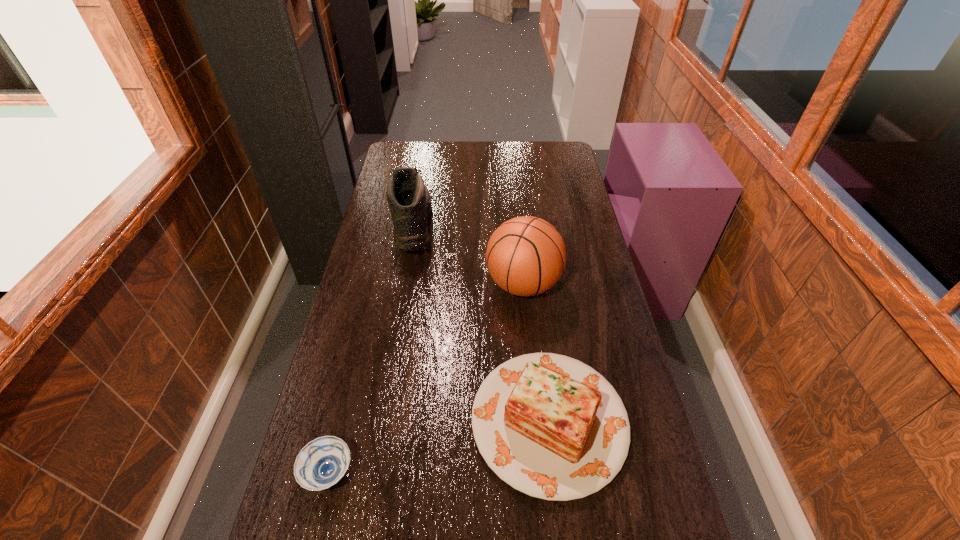
I want to click on ski boot, so click(x=409, y=200).

Where is `basketball`? The image size is (960, 540). basketball is located at coordinates (526, 256).

This screenshot has height=540, width=960. Find the location of `lasagna`. lasagna is located at coordinates (550, 426).

The width and height of the screenshot is (960, 540). Identify the location of the shortest object. (322, 462).

This screenshot has width=960, height=540. What are the coordinates of `vacant space located 0.070m on the front of the ski boot` in the screenshot? It's located at (403, 279).

Identify the location of free location located 0.320m on the back of the basketball. The width and height of the screenshot is (960, 540). [516, 207].

What are the coordinates of `vacant space located on the left of the second shortest object` in the screenshot? It's located at (332, 421).

Locate an element on the screen. Image resolution: width=960 pixels, height=540 pixels. vacant region located on the right of the shortest object is located at coordinates (466, 472).

Locate an element on the screen. ski boot at the left edge is located at coordinates (409, 200).

Where is `soup bowl that is positioned at the left edge`? The width and height of the screenshot is (960, 540). soup bowl that is positioned at the left edge is located at coordinates (322, 462).